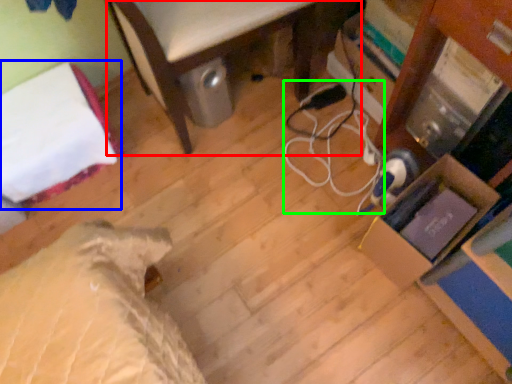
Question: Considering the real-world distances, which object is closest to furniture (highlighted by a red box)? bed (highlighted by a blue box) or cable (highlighted by a green box).

Choices:
 (A) bed
 (B) cable

Answer: (B)